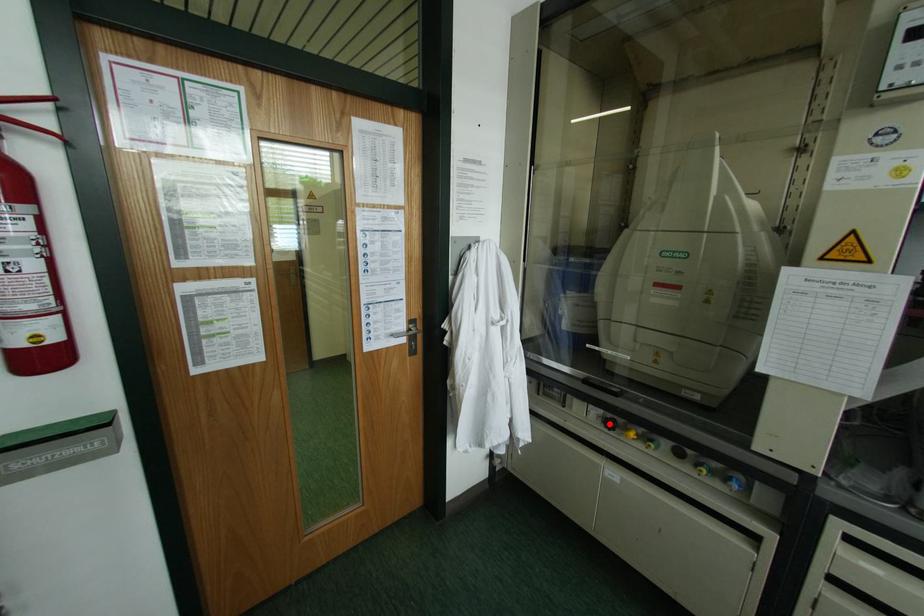
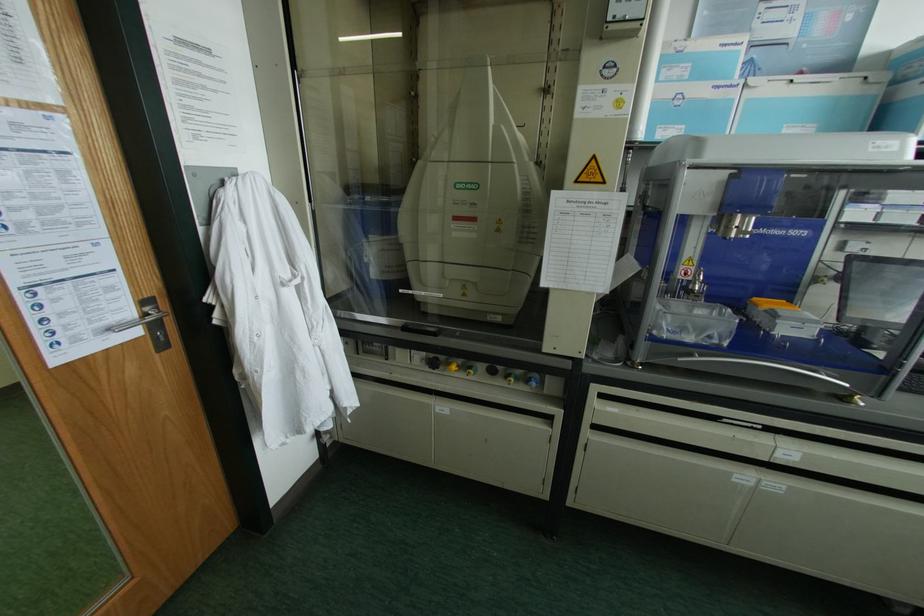
Locate, in the second image, the point that corresponds to the highlighted location in the first image.

(432, 363)